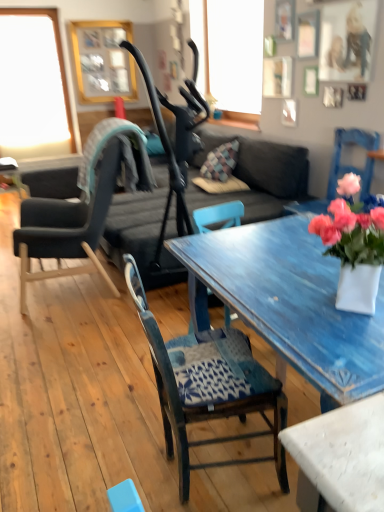
Question: Considering the positions of wooden chair with patterned cushion at center, the second chair when ordered from back to front, and gold wooden picture frame at upper center in the image, is wooden chair with patterned cushion at center, the second chair when ordered from back to front, bigger or smaller than gold wooden picture frame at upper center?

Choices:
 (A) big
 (B) small

Answer: (A)

Question: Does point (284, 480) appear closer or farther from the camera than point (104, 89)?

Choices:
 (A) farther
 (B) closer

Answer: (B)

Question: Estimate the real-world distances between objects in this image. Which object is farther from the dark gray fabric couch at center?

Choices:
 (A) pink matte vase at right
 (B) wooden chair with patterned cushion at center, the 2th chair positioned from the left
 (C) transparent glass window at upper left
 (D) teal fabric chair at center, positioned as the first chair in back-to-front order
 (E) gold wooden picture frame at upper center

Answer: (C)

Question: Based on their relative distances, which object is farther from the teal fabric chair at center, which is counted as the 2th chair, starting from the front?

Choices:
 (A) pink matte vase at right
 (B) gold wooden picture frame at upper center
 (C) transparent glass window at upper left
 (D) wooden chair with patterned cushion at center, the second chair when ordered from back to front
 (E) dark gray fabric couch at center

Answer: (B)